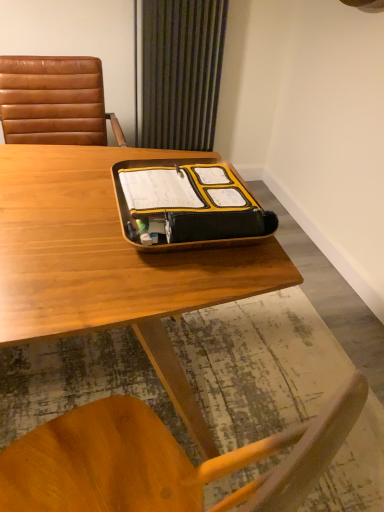
Question: Is point (36, 60) positioned closer to the camera than point (206, 90)?

Choices:
 (A) closer
 (B) farther

Answer: (A)

Question: Is brown leather chair at left inside the boundaries of green striped curtain at upper center, or outside?

Choices:
 (A) inside
 (B) outside

Answer: (B)

Question: Which of these objects is positioned farthest from the green striped curtain at upper center?

Choices:
 (A) wooden desk at center
 (B) brown leather chair at left
 (C) yellow matte tray at center

Answer: (C)

Question: Which is farther from the yellow matte tray at center?

Choices:
 (A) wooden desk at center
 (B) brown leather chair at left
 (C) green striped curtain at upper center

Answer: (C)